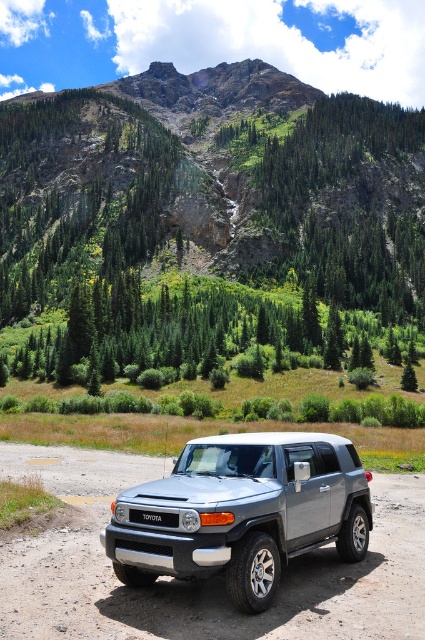
Is point (170, 172) positioned in front of point (288, 444)?

No.

Between green coniferous trees at upper center and satin silver suv at center, which one has more height?

Standing taller between the two is green coniferous trees at upper center.

Where is `green coniferous trees at upper center`? This screenshot has width=425, height=640. green coniferous trees at upper center is located at coordinates (209, 208).